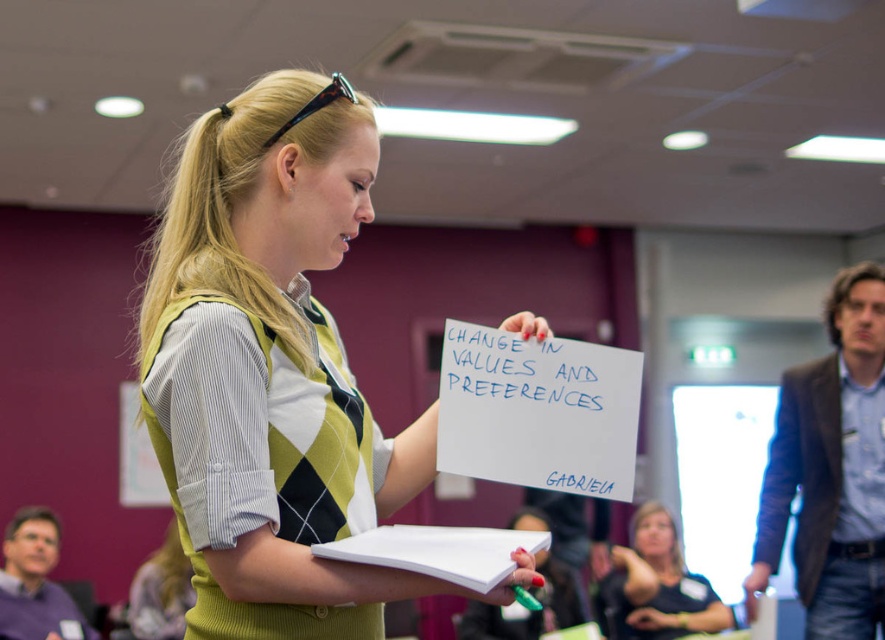
You are a person who is 1.7 meters tall and want to see the sign held by the woman in the conference room. The sign is located at point (541, 396). There is a notebook in your way at point 0.5, 0.5. Can you see the sign without moving either object?

The notebook at point 0.5, 0.5 is 1.47 meters away from the sign at point (541, 396). Since the distance between them is 1.47 meters, the notebook is blocking your view of the sign. You would need to move the notebook to see the sign clearly.

You are attending a presentation in the conference room and notice a woman holding a sign with some text. Where is the blue marker writing at center in relation to the blonde hair at center?

The blue marker writing at center is to the left of the blonde hair at center.